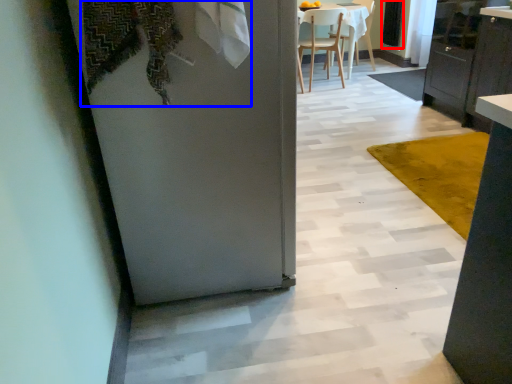
Question: Which point is closer to the camera, screen door (highlighted by a red box) or laundry (highlighted by a blue box)?

Choices:
 (A) screen door
 (B) laundry

Answer: (B)